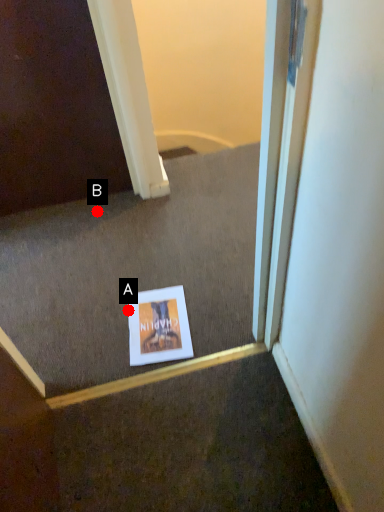
Question: Two points are circled on the image, labeled by A and B beside each circle. Which point is farther from the camera taking this photo?

Choices:
 (A) A is further
 (B) B is further

Answer: (B)